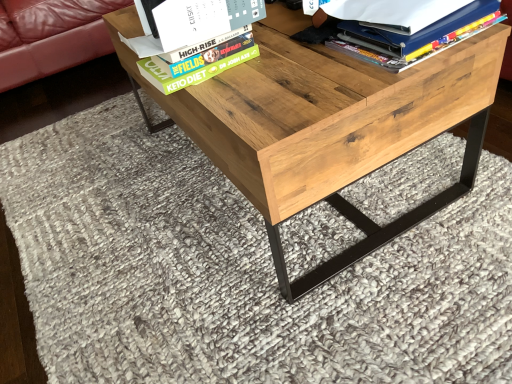
In order to click on unoccupied area in front of natural wood table at center in this screenshot , I will do `click(305, 304)`.